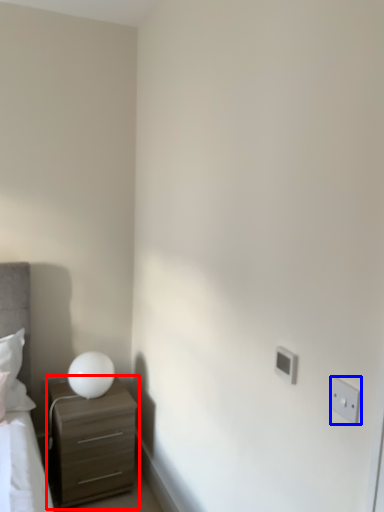
Question: Which object appears closest to the camera in this image, chest of drawers (highlighted by a red box) or electric outlet (highlighted by a blue box)?

Choices:
 (A) chest of drawers
 (B) electric outlet

Answer: (B)